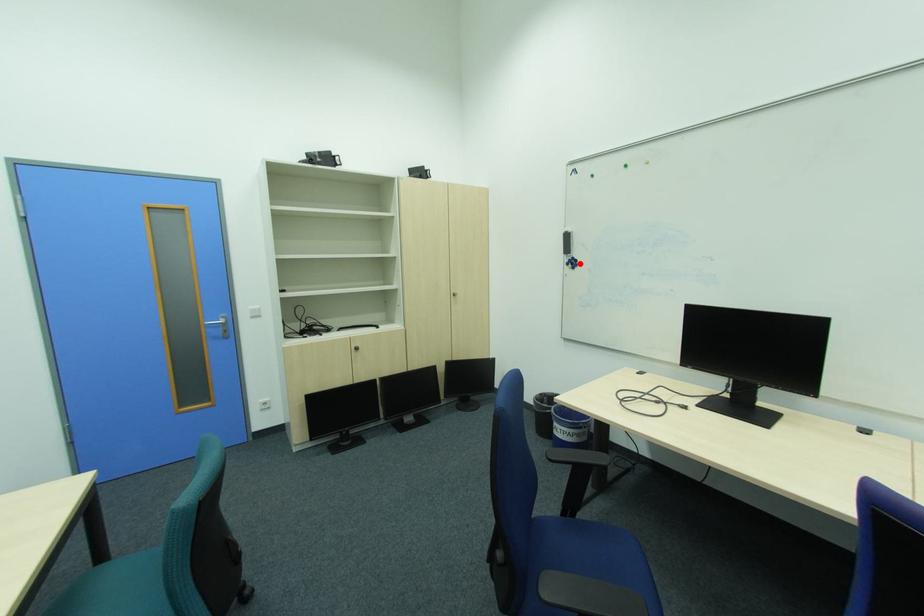
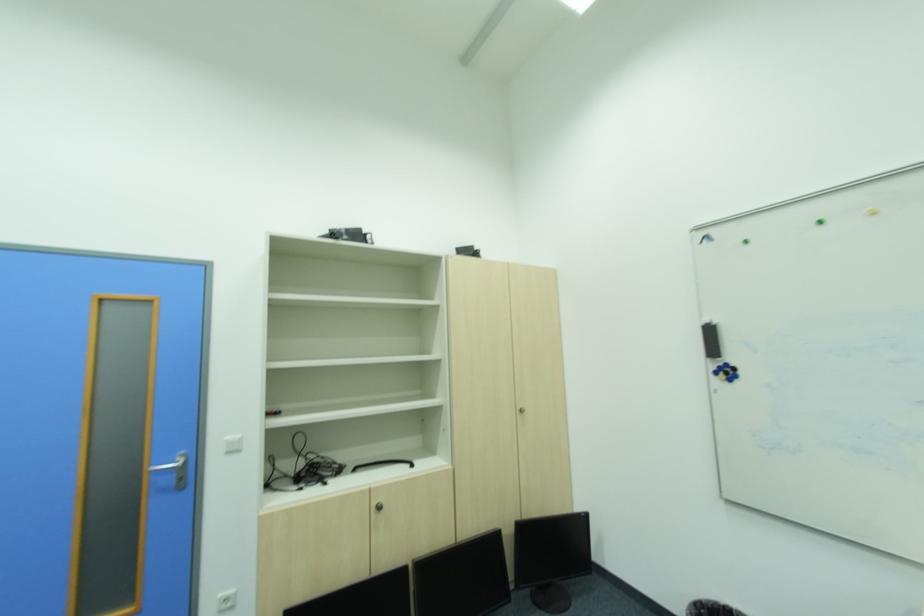
Find the pixel in the second image that matches the highlighted location in the first image.

(736, 371)